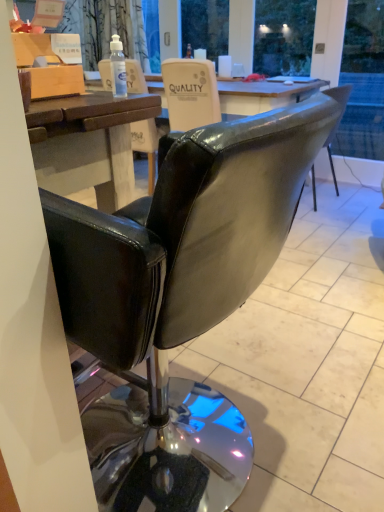
Question: Is the position of transparent plastic bottle at upper center more distant than that of black leather chair at center?

Choices:
 (A) yes
 (B) no

Answer: (A)

Question: Is transparent plastic bottle at upper center smaller than black leather chair at center?

Choices:
 (A) no
 (B) yes

Answer: (B)

Question: Does transparent plastic bottle at upper center turn towards black leather chair at center?

Choices:
 (A) no
 (B) yes

Answer: (A)

Question: Is transparent plastic bottle at upper center positioned beyond the bounds of black leather chair at center?

Choices:
 (A) no
 (B) yes

Answer: (B)

Question: Is transparent plastic bottle at upper center looking in the opposite direction of black leather chair at center?

Choices:
 (A) yes
 (B) no

Answer: (B)

Question: Is point (152, 500) closer or farther from the camera than point (120, 77)?

Choices:
 (A) farther
 (B) closer

Answer: (B)

Question: Is black leather chair at center spatially inside transparent plastic bottle at upper center, or outside of it?

Choices:
 (A) outside
 (B) inside

Answer: (A)

Question: Considering the positions of black leather chair at center and transparent plastic bottle at upper center in the image, is black leather chair at center taller or shorter than transparent plastic bottle at upper center?

Choices:
 (A) short
 (B) tall

Answer: (B)

Question: Is black leather chair at center in front of or behind transparent plastic bottle at upper center in the image?

Choices:
 (A) front
 (B) behind

Answer: (A)

Question: Based on their sizes in the image, would you say wooden box at upper left is bigger or smaller than transparent plastic bottle at upper center?

Choices:
 (A) small
 (B) big

Answer: (B)

Question: Considering their positions, is wooden box at upper left located in front of or behind transparent plastic bottle at upper center?

Choices:
 (A) front
 (B) behind

Answer: (A)

Question: From the image's perspective, is wooden box at upper left above or below transparent plastic bottle at upper center?

Choices:
 (A) below
 (B) above

Answer: (B)

Question: Does point (24, 45) appear closer or farther from the camera than point (119, 58)?

Choices:
 (A) closer
 (B) farther

Answer: (A)

Question: Is transparent plastic bottle at upper center to the left or to the right of wooden box at upper left in the image?

Choices:
 (A) left
 (B) right

Answer: (B)

Question: From the image's perspective, is transparent plastic bottle at upper center located above or below wooden box at upper left?

Choices:
 (A) below
 (B) above

Answer: (A)